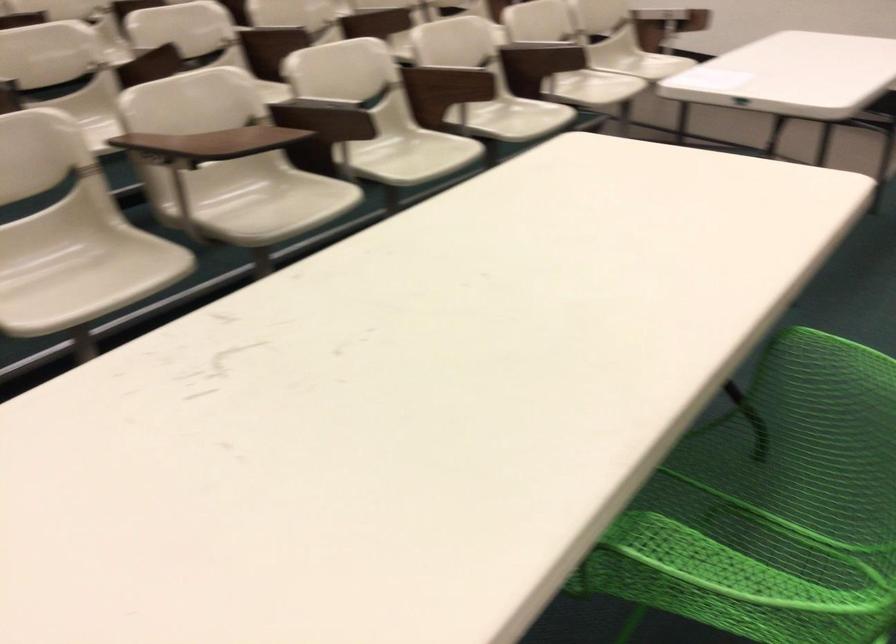
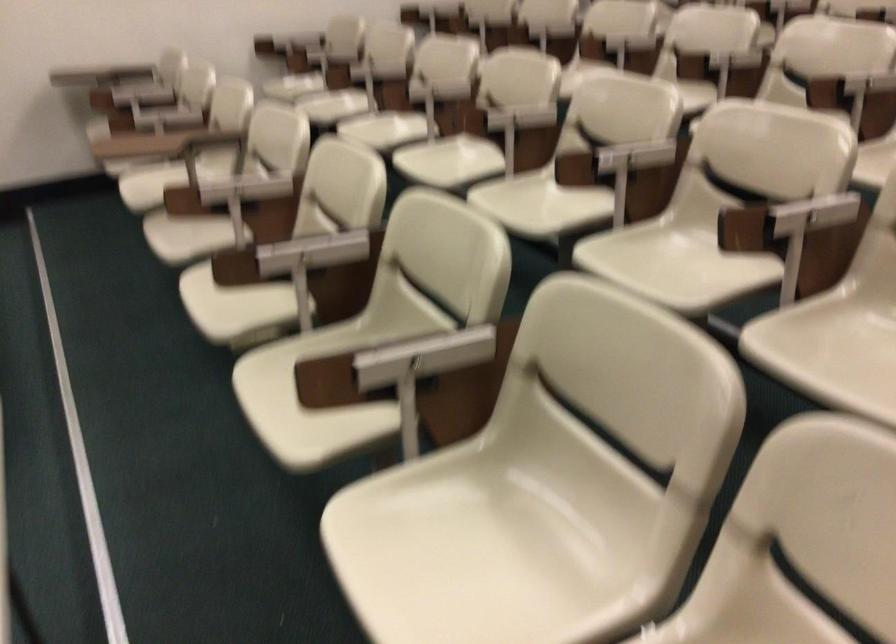
The point at (470, 76) is marked in the first image. Where is the corresponding point in the second image?

(290, 256)